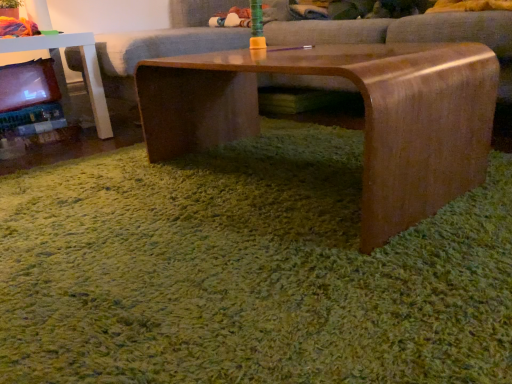
The width and height of the screenshot is (512, 384). I want to click on free region on the left part of shiny brown wood coffee table at center, so click(104, 195).